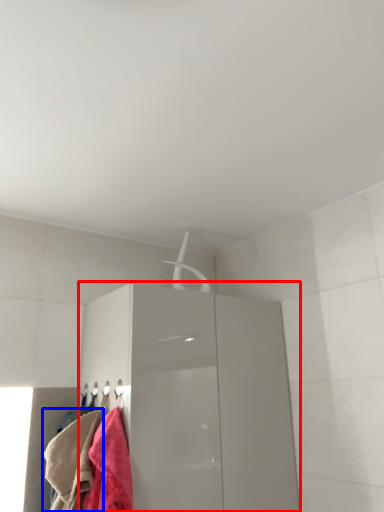
Question: Which object appears closest to the camera in this image, cabinetry (highlighted by a red box) or towel (highlighted by a blue box)?

Choices:
 (A) cabinetry
 (B) towel

Answer: (B)